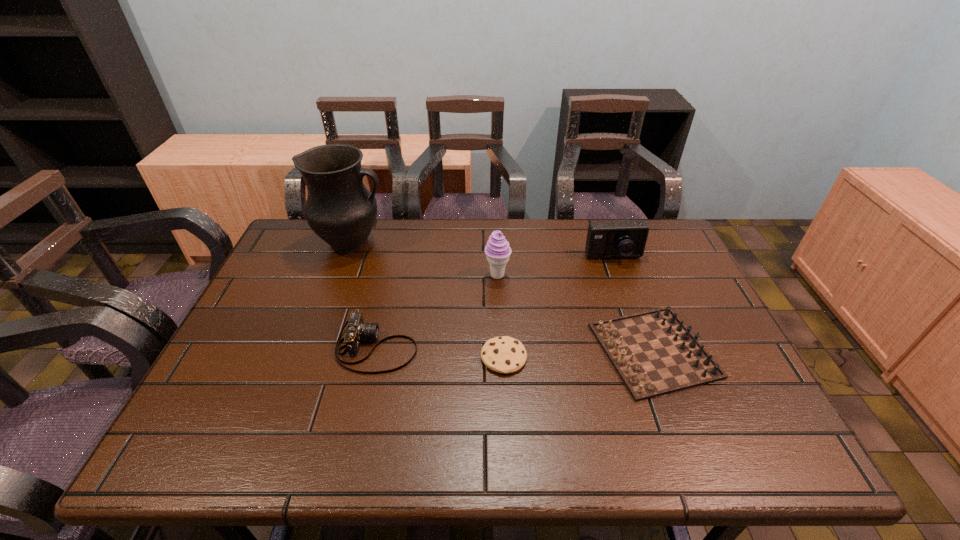
Where is `free space that satisfies the following two spatial constraints: 1. on the front side of the third farthest object; 2. on the front-facing side of the nearer camera`? This screenshot has height=540, width=960. free space that satisfies the following two spatial constraints: 1. on the front side of the third farthest object; 2. on the front-facing side of the nearer camera is located at coordinates (500, 347).

Image resolution: width=960 pixels, height=540 pixels. Find the location of `vacant point that satisfies the following two spatial constraints: 1. on the handle side of the pitcher; 2. on the back side of the second tallest object`. vacant point that satisfies the following two spatial constraints: 1. on the handle side of the pitcher; 2. on the back side of the second tallest object is located at coordinates (340, 275).

In order to click on blank area in the image that satisfies the following two spatial constraints: 1. on the handle side of the chessboard; 2. on the right side of the tallest object in this screenshot , I will do `click(312, 350)`.

Image resolution: width=960 pixels, height=540 pixels. In order to click on vacant area in the image that satisfies the following two spatial constraints: 1. on the handle side of the chessboard; 2. on the left side of the tallest object in this screenshot , I will do `click(312, 350)`.

The width and height of the screenshot is (960, 540). I want to click on vacant space that satisfies the following two spatial constraints: 1. on the handle side of the pitcher; 2. on the right side of the shortest object, so click(310, 357).